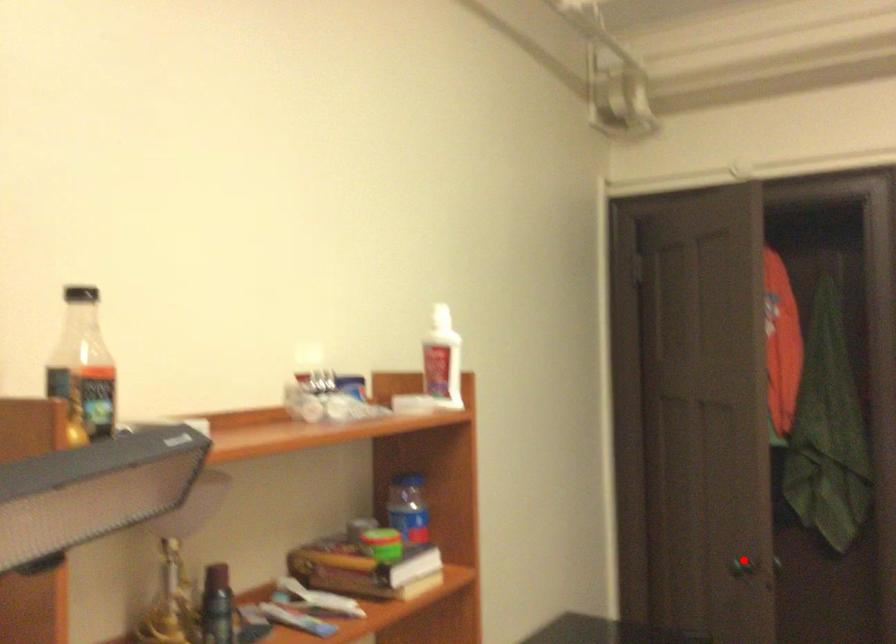
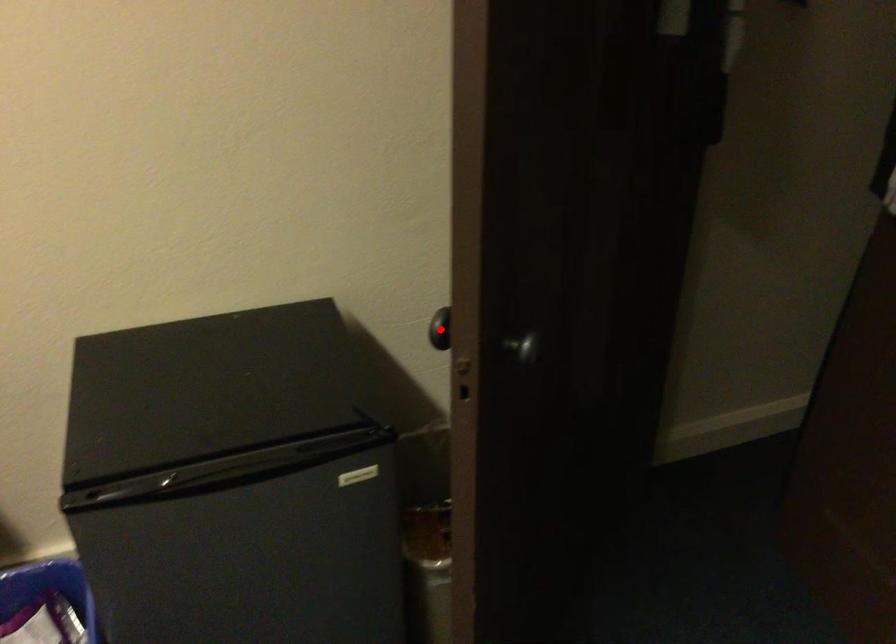
I am providing you with two images of the same scene from different viewpoints. A red point is marked on the first image and another point is marked on the second image. Do the highlighted points in image1 and image2 indicate the same real-world spot?

Yes